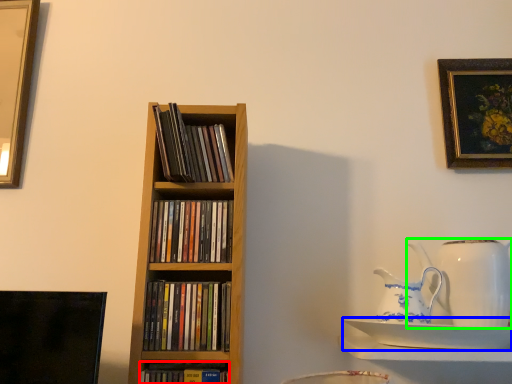
Question: Based on their relative distances, which object is farther from book (highlighted by a red box)? Choose from saucer (highlighted by a blue box) and jug (highlighted by a green box).

Choices:
 (A) saucer
 (B) jug

Answer: (B)